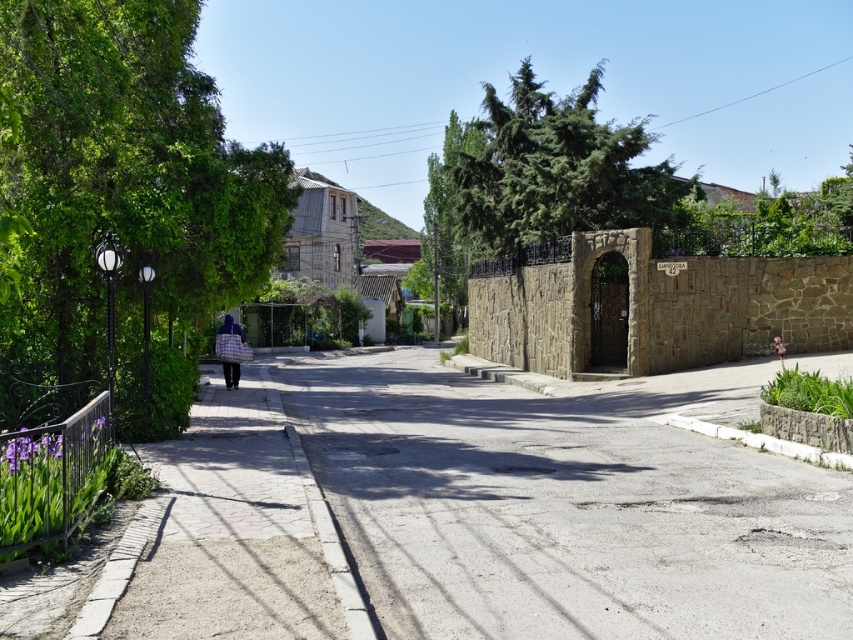
Question: Which point is farther to the camera?

Choices:
 (A) green leafy tree at left
 (B) paved stone path at center
 (C) blue plaid bag at center
 (D) green textured stone gate at center

Answer: (D)

Question: Is the position of gray concrete pavement at center more distant than that of green textured stone gate at center?

Choices:
 (A) yes
 (B) no

Answer: (B)

Question: Which point is farther from the camera taking this photo?

Choices:
 (A) (228, 410)
 (B) (454, 636)
 (C) (106, 305)

Answer: (A)

Question: Which point appears farthest from the camera in this image?

Choices:
 (A) (194, 460)
 (B) (230, 360)
 (C) (544, 204)

Answer: (C)

Question: Is green leafy tree at left above blue plaid bag at center?

Choices:
 (A) yes
 (B) no

Answer: (A)

Question: Can you confirm if gray concrete pavement at center is thinner than blue plaid bag at center?

Choices:
 (A) no
 (B) yes

Answer: (A)